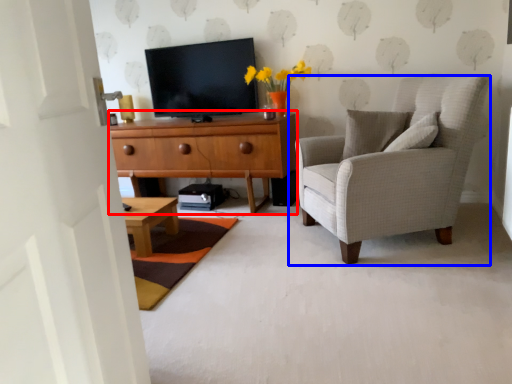
Question: Which of the following is the farthest to the observer, cabinetry (highlighted by a red box) or chair (highlighted by a blue box)?

Choices:
 (A) cabinetry
 (B) chair

Answer: (A)